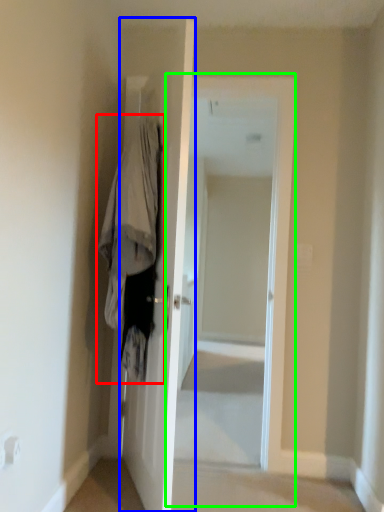
Question: Which object is the farthest from clothing (highlighted by a red box)? Choose among these: door (highlighted by a blue box) or screen door (highlighted by a green box).

Choices:
 (A) door
 (B) screen door

Answer: (B)